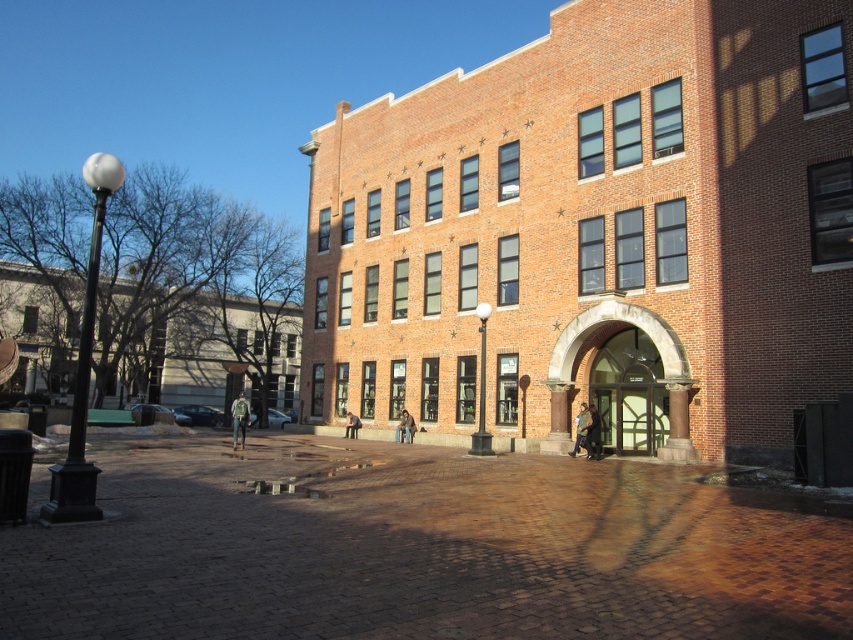
You are a delivery person trying to enter the building through the clear glass door at center. The delivery cart you are pushing is 2 meters tall. Will the brick archway at center allow the cart to pass through?

The brick archway at center has a lesser height compared to clear glass door at center. Since the archway is shorter, the 2 meter tall delivery cart may not fit. You should use the clear glass door at center instead which is taller.

You are standing in front of the brick building and want to find the entrance. According to the image, where is the brick archway at center located in terms of its 2D coordinates?

The brick archway at center is located at the 2D coordinates of point (659, 355).